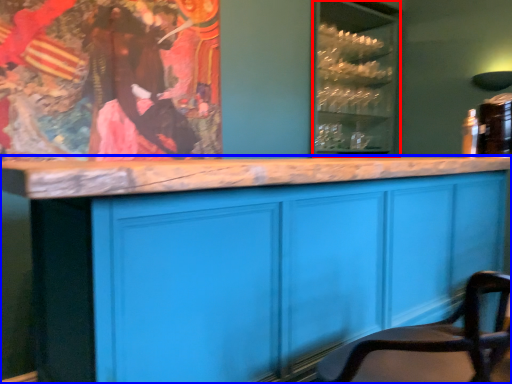
Question: Among these objects, which one is nearest to the camera, glass door (highlighted by a red box) or cabinetry (highlighted by a blue box)?

Choices:
 (A) glass door
 (B) cabinetry

Answer: (B)